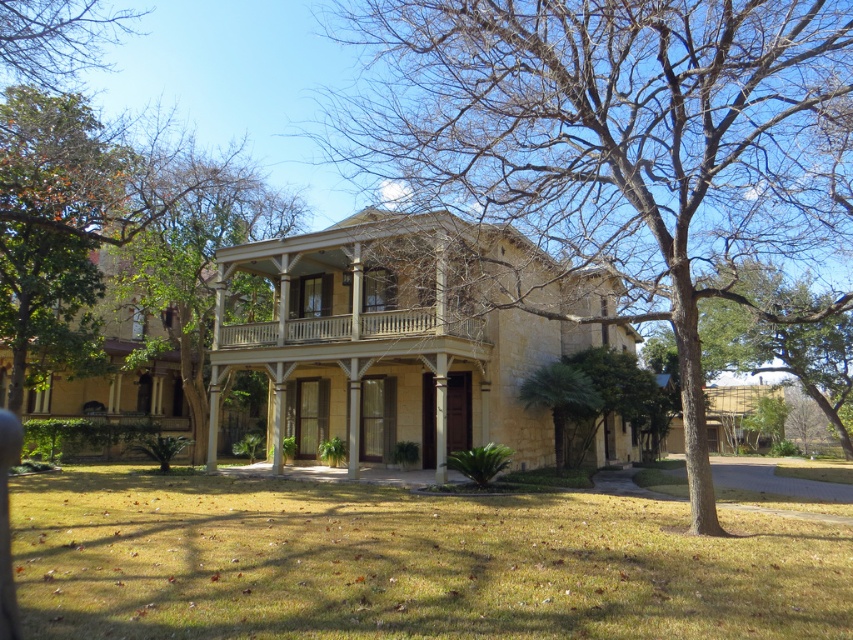
You are a gardener planning to plant a new tree in the front yard. You have two options for placement based on the existing trees. The first option is next to the brown bark tree at center, and the second is near the brown wood tree at upper left. Which location would require more space due to the existing tree width?

The brown bark tree at center might be wider than brown wood tree at upper left, so planting next to the brown bark tree at center would require more space due to its potentially larger width.

You are a landscape architect planning to add a new garden bed between the brown bark tree at center and the brown wood tree at upper left. Which tree should you consider for the garden bed placement to ensure it has enough space?

The brown bark tree at center is larger in size than the brown wood tree at upper left, so the garden bed should be placed near the brown bark tree at center to accommodate its size.